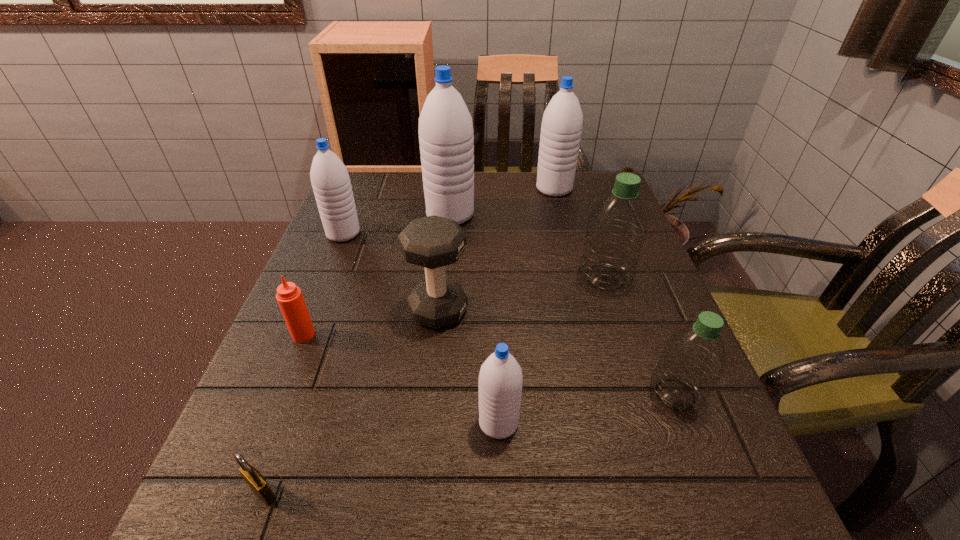
The width and height of the screenshot is (960, 540). Find the location of `the fourth object from right to left`. the fourth object from right to left is located at coordinates (500, 379).

Identify the location of the nearest blue water bottle. (500, 379).

I want to click on Tabasco sauce, so click(x=289, y=297).

Identify the location of brass padlock. The image size is (960, 540). (254, 479).

This screenshot has width=960, height=540. Find the location of `the nearest object`. the nearest object is located at coordinates (254, 479).

The height and width of the screenshot is (540, 960). What are the coordinates of `blank space located on the back of the second water bottle from left to right` in the screenshot? It's located at coord(453,187).

Locate an element on the screen. The image size is (960, 540). vacant space positioned on the front of the rightmost blue water bottle is located at coordinates (562, 217).

Where is `free space located on the back of the leftmost blue water bottle`? free space located on the back of the leftmost blue water bottle is located at coordinates (356, 203).

The image size is (960, 540). Find the location of `blank space located 0.370m on the front of the farther green water bottle`. blank space located 0.370m on the front of the farther green water bottle is located at coordinates (669, 475).

Locate an element on the screen. The width and height of the screenshot is (960, 540). blank area located 0.120m on the left of the dumbbell is located at coordinates (348, 311).